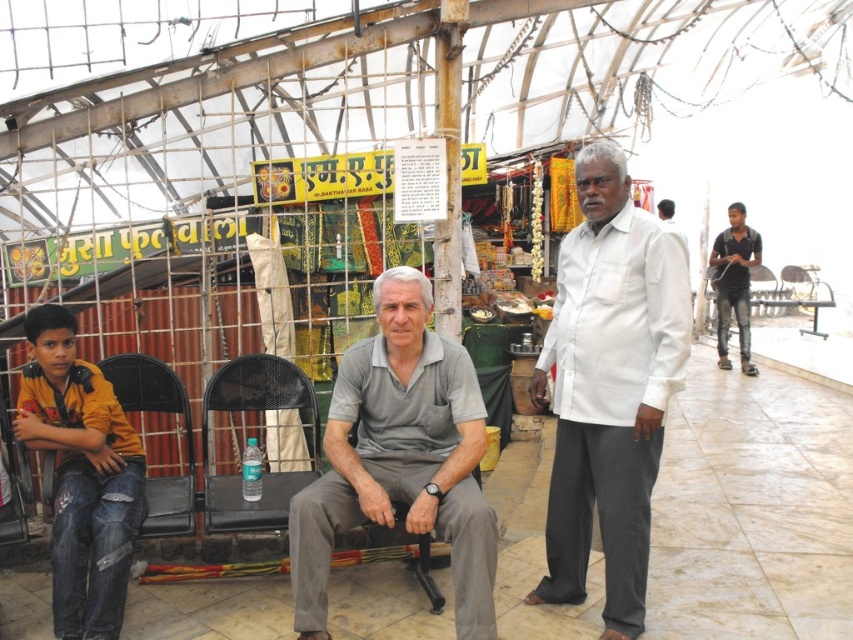
Question: Which object is positioned closest to the jeans at left?

Choices:
 (A) gray cotton shirt at center
 (B) black cotton shirt at right
 (C) black mesh chair at center
 (D) white cotton shirt at center

Answer: (C)

Question: In this image, where is jeans at left located relative to black cotton shirt at right?

Choices:
 (A) right
 (B) left

Answer: (B)

Question: Does white cotton shirt at center have a greater width compared to jeans at left?

Choices:
 (A) yes
 (B) no

Answer: (B)

Question: Which of the following is the closest to the observer?

Choices:
 (A) white cotton shirt at center
 (B) black cotton shirt at right

Answer: (A)

Question: Does gray cotton shirt at center appear on the left side of black cotton shirt at right?

Choices:
 (A) no
 (B) yes

Answer: (B)

Question: Which point is farther from the camera taking this photo?

Choices:
 (A) (283, 529)
 (B) (718, 321)
 (C) (456, 387)

Answer: (B)